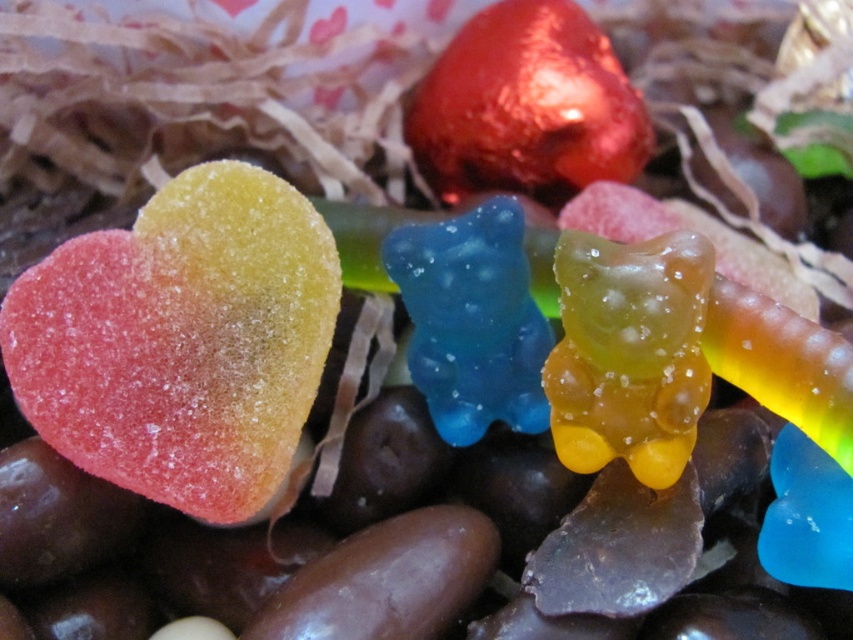
Does shiny metallic heart at upper center have a lesser height compared to translucent blue gummy bear at center?

No, shiny metallic heart at upper center is not shorter than translucent blue gummy bear at center.

Between point (566, 141) and point (401, 243), which one is positioned behind?

Point (566, 141)

Does point (480, 65) come in front of point (543, 401)?

No, it is not.

Where is `shiny metallic heart at upper center`? The height and width of the screenshot is (640, 853). shiny metallic heart at upper center is located at coordinates (527, 106).

Between point (550, 196) and point (585, 273), which one is positioned in front?

Point (585, 273)

Looking at this image, does shiny metallic heart at upper center come in front of translucent yellowish-gold bear at center?

No, it is behind translucent yellowish-gold bear at center.

I want to click on shiny metallic heart at upper center, so click(x=527, y=106).

Where is `shiny metallic heart at upper center`? The height and width of the screenshot is (640, 853). shiny metallic heart at upper center is located at coordinates click(527, 106).

Is rainbow-colored sugar-coated heart at left closer to the viewer compared to shiny metallic heart at upper center?

Yes, rainbow-colored sugar-coated heart at left is closer to the viewer.

Describe the element at coordinates (181, 340) in the screenshot. I see `rainbow-colored sugar-coated heart at left` at that location.

Which is behind, point (247, 202) or point (409, 122)?

Positioned behind is point (409, 122).

Image resolution: width=853 pixels, height=640 pixels. In order to click on rainbow-colored sugar-coated heart at left in this screenshot , I will do `click(181, 340)`.